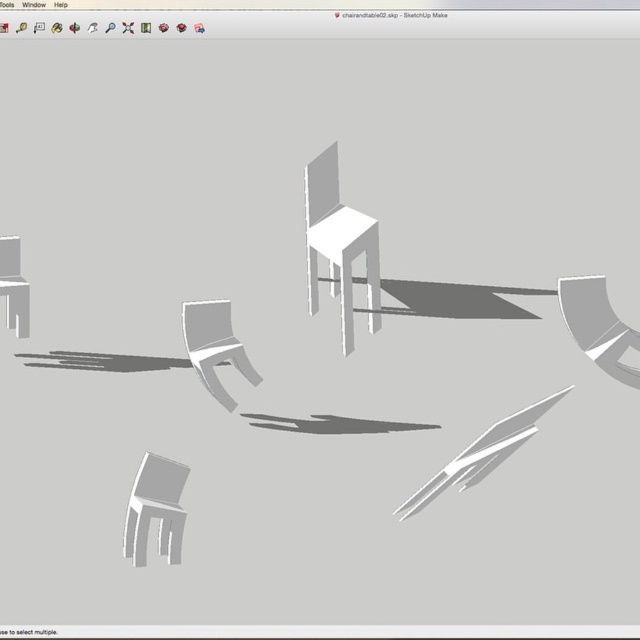
From the picture: You are an interior designer working on a virtual layout. You need to place a new sofa in the room such that it is between the white matte chair at center and the matte white cabinet at left. Is this possible based on their current positions?

The white matte chair at center is above the matte white cabinet at left, so placing a sofa between them would require positioning it along the vertical axis between the two objects. Since the question specifies placing the sofa between them in the room, which typically implies horizontal placement, this might not be feasible unless the layout allows vertical arrangement. However, based on their vertical positioning, a sofa placed below the chair and above the cabinet could technically be between them.

You are using SketchUp Make and need to adjust the position of the matte gray chair at lower left. If the camera is currently 6 feet away from the chair, should you move the chair closer or farther away to match the recommended distance of 5.28 feet?

The matte gray chair at lower left needs to be moved closer to the camera by 0.72 feet to reach the recommended distance of 5.28 feet.